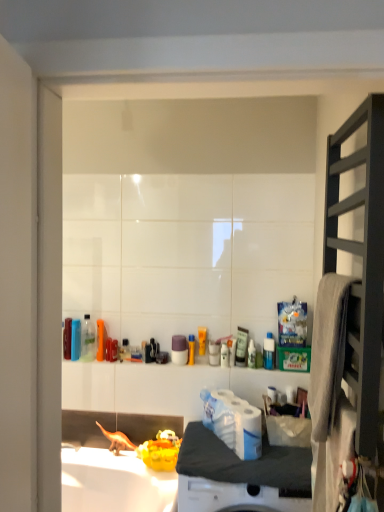
Measure the distance between white matte counter top at center and camera.

white matte counter top at center and camera are 1.55 meters apart from each other.

You are a GUI agent. You are given a task and a screenshot of the screen. Output one action in this format:
    pyautogui.click(x=<x>, y=<y>)
    Task: Click on the white glossy toilet paper at center
    The image size is (384, 512).
    Given the screenshot: What is the action you would take?
    point(233,422)

Is dark wood shelf at right positioned with its back to white matte counter top at center?

dark wood shelf at right does not have its back to white matte counter top at center.

Considering the relative positions of dark wood shelf at right and white matte counter top at center in the image provided, is dark wood shelf at right to the left of white matte counter top at center from the viewer's perspective?

In fact, dark wood shelf at right is to the right of white matte counter top at center.

From the image's perspective, which one is positioned lower, dark wood shelf at right or white matte counter top at center?

white matte counter top at center.

Considering their positions, is dark wood shelf at right located in front of or behind white matte counter top at center?

dark wood shelf at right is positioned closer to the viewer than white matte counter top at center.

Is white glossy toilet paper at center thinner than dark wood shelf at right?

No.

How much distance is there between white glossy toilet paper at center and dark wood shelf at right?

white glossy toilet paper at center is 34.86 inches from dark wood shelf at right.

This screenshot has height=512, width=384. In the image, there is a dark wood shelf at right. Find the location of `toilet paper below it (from a real-world perspective)`. toilet paper below it (from a real-world perspective) is located at coordinates (233, 422).

Looking at the image, does white glossy toilet paper at center seem bigger or smaller compared to dark wood shelf at right?

In the image, white glossy toilet paper at center appears to be smaller than dark wood shelf at right.

Is white matte counter top at center completely or partially outside of dark wood shelf at right?

That's correct, white matte counter top at center is outside of dark wood shelf at right.

Between point (262, 463) and point (375, 411), which one is positioned in front?

The point (375, 411) is closer.

Can you confirm if white matte counter top at center is smaller than dark wood shelf at right?

Yes.

Are white matte counter top at center and dark wood shelf at right beside each other?

No, white matte counter top at center is not with dark wood shelf at right.

From a real-world perspective, between white glossy toilet paper at center and white matte counter top at center, who is vertically higher?

From a 3D spatial view, white glossy toilet paper at center is above.

In the image, is white glossy toilet paper at center on the left side or the right side of white matte counter top at center?

white glossy toilet paper at center is positioned on white matte counter top at center's left side.

Is white matte counter top at center surrounded by white glossy toilet paper at center?

No, white matte counter top at center is located outside of white glossy toilet paper at center.

Which is in front, white glossy toilet paper at center or white matte counter top at center?

white matte counter top at center is in front.

Does point (323, 259) come behind point (235, 451)?

Yes, it is.

Is white glossy toilet paper at center at the back of dark wood shelf at right?

No, dark wood shelf at right is not facing the opposite direction of white glossy toilet paper at center.

How many degrees apart are the facing directions of dark wood shelf at right and white glossy toilet paper at center?

The angular difference between dark wood shelf at right and white glossy toilet paper at center is 29.2 degrees.

Which of these two, dark wood shelf at right or white glossy toilet paper at center, stands taller?

Standing taller between the two is dark wood shelf at right.

Who is taller, white matte counter top at center or white glossy toilet paper at center?

With more height is white glossy toilet paper at center.

From the image's perspective, which object appears higher, white matte counter top at center or white glossy toilet paper at center?

white glossy toilet paper at center is shown above in the image.

In the scene shown: Does white matte counter top at center turn towards white glossy toilet paper at center?

No, white matte counter top at center is not turned towards white glossy toilet paper at center.

From a real-world perspective, is white matte counter top at center beneath white glossy toilet paper at center?

Correct, in the physical world, white matte counter top at center is lower than white glossy toilet paper at center.

Identify the location of shelf above the white matte counter top at center (from the image's perspective). (361, 255).

Locate an element on the screen. The width and height of the screenshot is (384, 512). shelf on the right of white glossy toilet paper at center is located at coordinates (361, 255).

Based on their spatial positions, is dark wood shelf at right or white matte counter top at center closer to white glossy toilet paper at center?

white matte counter top at center is positioned closer to the anchor white glossy toilet paper at center.

Estimate the real-world distances between objects in this image. Which object is further from dark wood shelf at right, white matte counter top at center or white glossy toilet paper at center?

white glossy toilet paper at center.

Looking at the image, which one is located further to dark wood shelf at right, white glossy toilet paper at center or white matte counter top at center?

The object further to dark wood shelf at right is white glossy toilet paper at center.

Looking at this image, which object lies nearer to the anchor point white matte counter top at center, white glossy toilet paper at center or dark wood shelf at right?

white glossy toilet paper at center lies closer to white matte counter top at center than the other object.

From the image, which object appears to be farther from white glossy toilet paper at center, white matte counter top at center or dark wood shelf at right?

Based on the image, dark wood shelf at right appears to be further to white glossy toilet paper at center.

Based on the photo, which object lies further to the anchor point white matte counter top at center, dark wood shelf at right or white glossy toilet paper at center?

dark wood shelf at right lies further to white matte counter top at center than the other object.

At what (x,y) coordinates should I click in order to perform the action: click on toilet paper between dark wood shelf at right and white matte counter top at center in the vertical direction. Please return your answer as a coordinate pair (x, y). The image size is (384, 512). Looking at the image, I should click on pos(233,422).